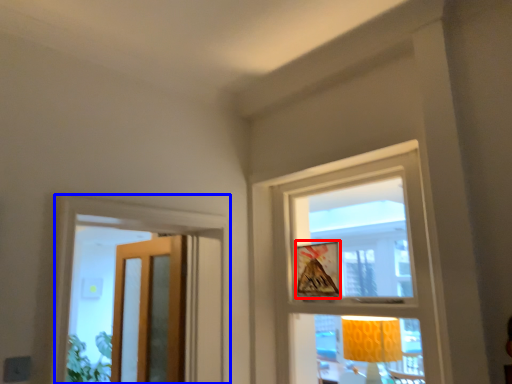
Question: Which object appears closest to the camera in this image, picture frame (highlighted by a red box) or window (highlighted by a blue box)?

Choices:
 (A) picture frame
 (B) window

Answer: (B)